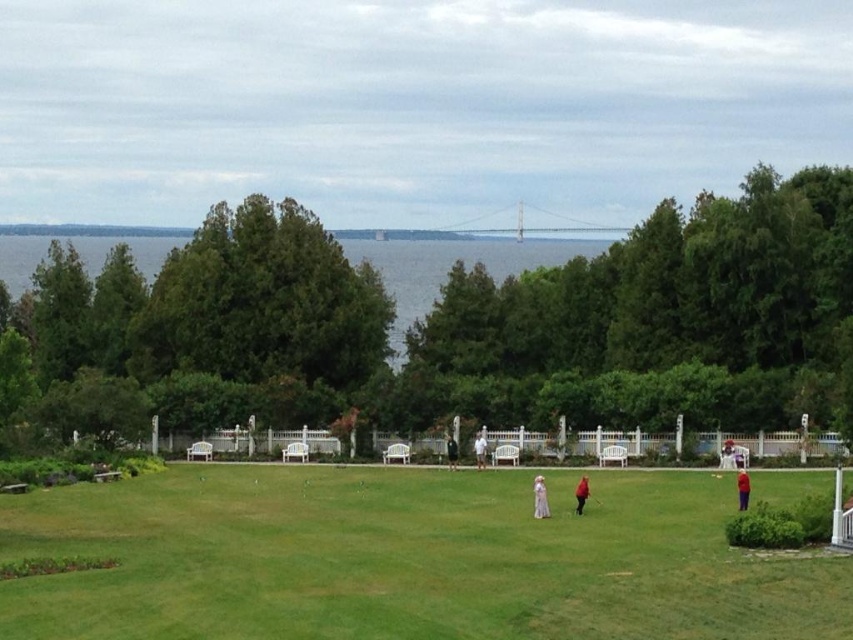
Find the location of a particular element. This screenshot has height=640, width=853. white cotton dress at center is located at coordinates (479, 449).

Who is more distant from viewer, (x=485, y=456) or (x=451, y=461)?

The point (x=485, y=456) is behind.

You are a GUI agent. You are given a task and a screenshot of the screen. Output one action in this format:
    pyautogui.click(x=<x>, y=<y>)
    Task: Click on the white cotton dress at center
    
    Given the screenshot: What is the action you would take?
    pyautogui.click(x=479, y=449)

Is the position of green grass at center more distant than that of dark gray sweater at center?

No, green grass at center is in front of dark gray sweater at center.

Which is behind, point (271, 486) or point (451, 468)?

Positioned behind is point (451, 468).

Is point (488, 630) closer to viewer compared to point (454, 449)?

Yes, it is in front of point (454, 449).

Locate an element on the screen. The height and width of the screenshot is (640, 853). green grass at center is located at coordinates (405, 560).

Which of these two, red velvet coat at lower right or white cotton dress at center, stands shorter?

With less height is white cotton dress at center.

Looking at this image, does red velvet coat at lower right have a lesser width compared to white cotton dress at center?

In fact, red velvet coat at lower right might be wider than white cotton dress at center.

Who is more forward, [743,497] or [479,444]?

Positioned in front is point [743,497].

You are a GUI agent. You are given a task and a screenshot of the screen. Output one action in this format:
    pyautogui.click(x=<x>, y=<y>)
    Task: Click on the red velvet coat at lower right
    This screenshot has width=853, height=640.
    Given the screenshot: What is the action you would take?
    pyautogui.click(x=741, y=486)